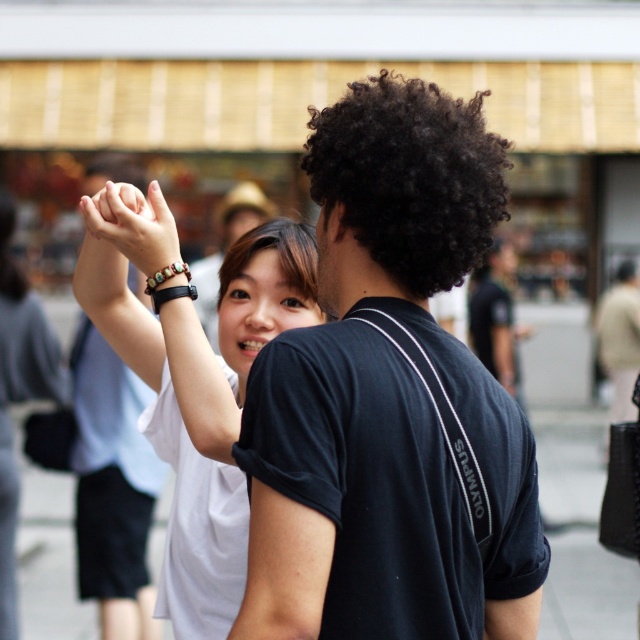
Question: Is matte brown bracelet at upper center thinner than curly hair at upper center?

Choices:
 (A) yes
 (B) no

Answer: (B)

Question: Can you confirm if dark curly hair at upper center is wider than curly hair at upper center?

Choices:
 (A) yes
 (B) no

Answer: (A)

Question: Is black matte shirt at center above dark curly hair at upper center?

Choices:
 (A) yes
 (B) no

Answer: (B)

Question: Based on their relative distances, which object is nearer to the curly hair at upper center?

Choices:
 (A) matte brown bracelet at upper center
 (B) dark curly hair at upper center
 (C) black matte shirt at center

Answer: (A)

Question: Which object is farther from the camera taking this photo?

Choices:
 (A) black curly hair at center
 (B) white matte bracelet at upper left
 (C) matte brown bracelet at upper center
 (D) white matte shirt at upper left

Answer: (D)

Question: Based on their relative distances, which object is nearer to the matte brown bracelet at upper center?

Choices:
 (A) white matte shirt at upper left
 (B) dark curly hair at upper center
 (C) black matte shirt at center

Answer: (B)